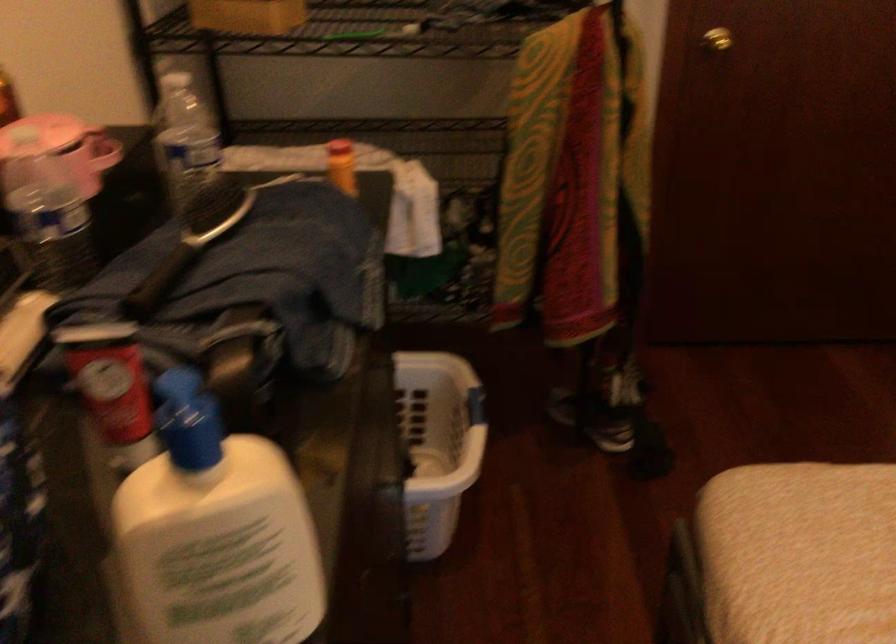
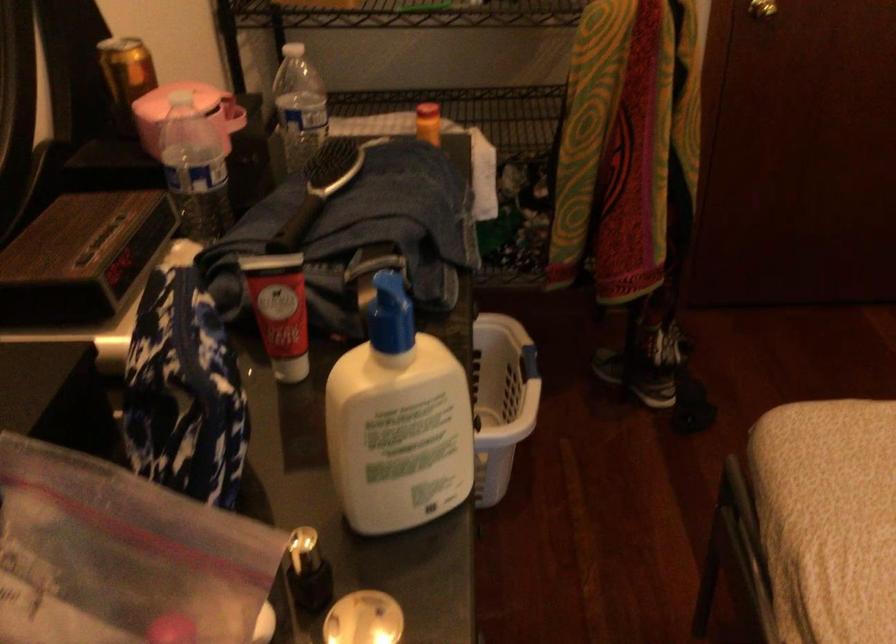
Find the pixel in the second image that matches [470,409] in the first image.

(529, 363)